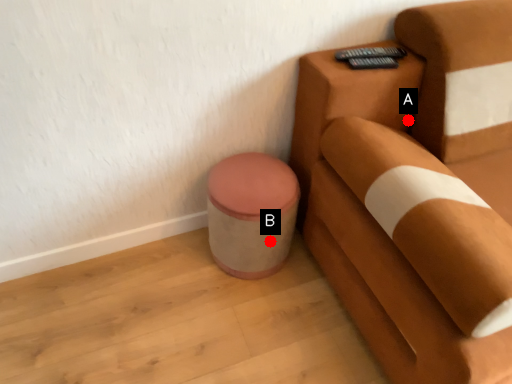
Question: Two points are circled on the image, labeled by A and B beside each circle. Among these points, which one is nearest to the camera?

Choices:
 (A) A is closer
 (B) B is closer

Answer: (A)